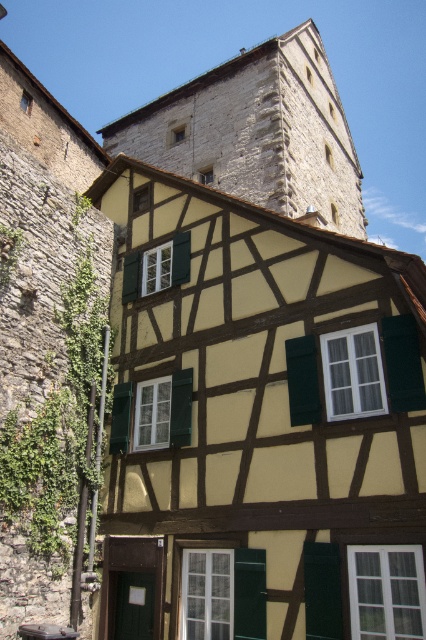
Is point (206, 115) farther from camera compared to point (371, 404)?

Yes, it is.

Can you confirm if stone tower at upper center is wider than green matte shutter at center?

Yes, stone tower at upper center is wider than green matte shutter at center.

Measure the distance between point (340, 152) and camera.

Point (340, 152) and camera are 173.54 feet apart.

Locate an element on the screen. This screenshot has height=640, width=426. stone tower at upper center is located at coordinates (258, 132).